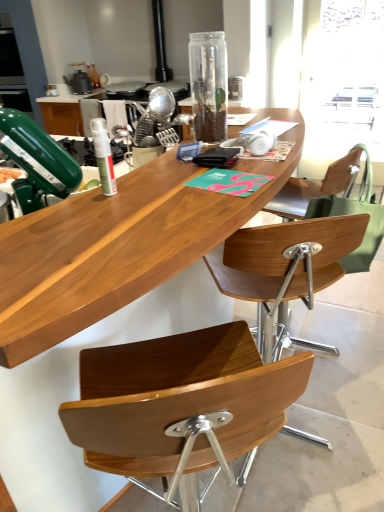
In order to click on free space that is to the left of white matte spray can at center, the second bottle when ordered from top to bottom in this screenshot , I will do `click(62, 200)`.